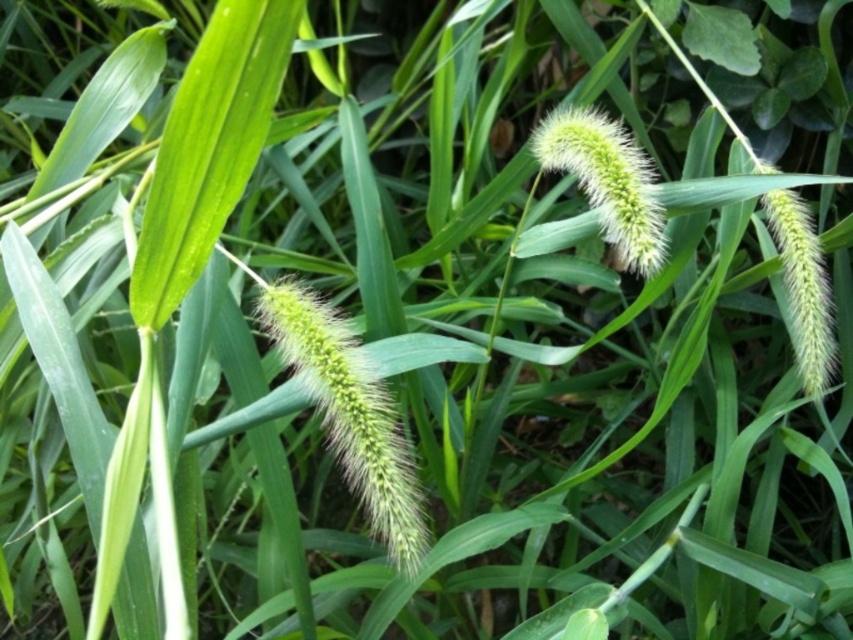
Between green fuzzy grass at center and green fuzzy flower at center, which one has less height?

Standing shorter between the two is green fuzzy flower at center.

At what (x,y) coordinates should I click in order to perform the action: click on green fuzzy grass at center. Please return your answer as a coordinate pair (x, y). Looking at the image, I should click on (350, 413).